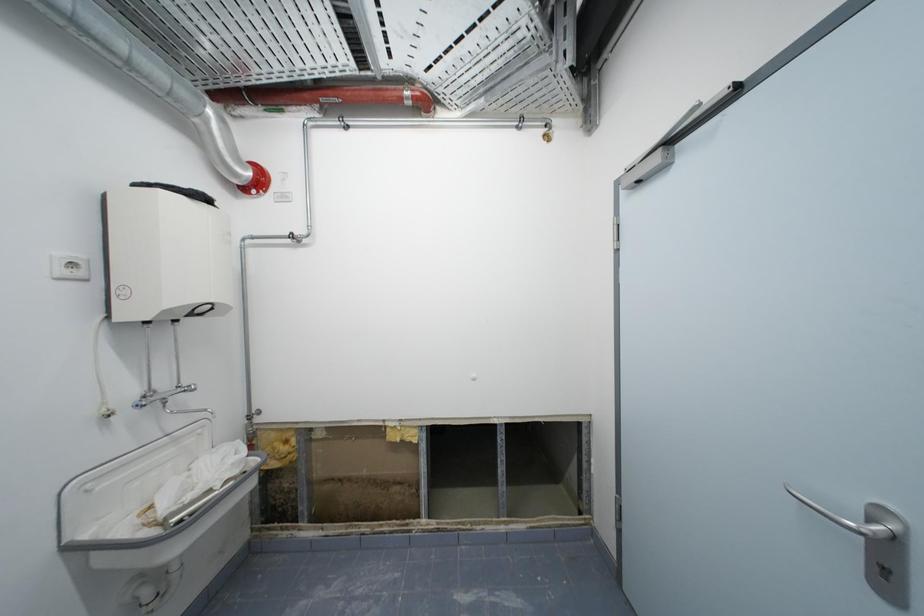
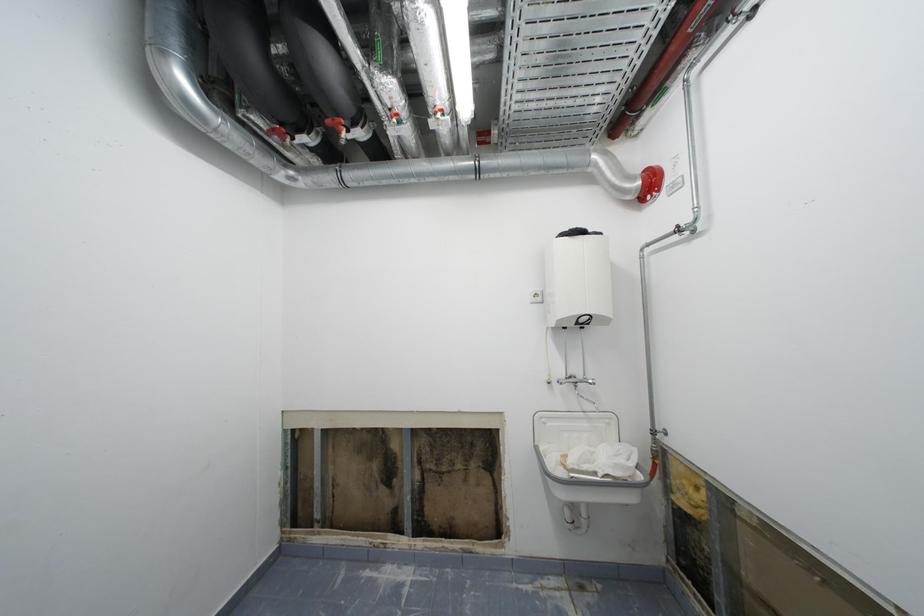
Question: The camera is either moving clockwise (left) or counter-clockwise (right) around the object. The first image is from the beginning of the video and the second image is from the end. Is the camera moving left or right when shooting the video?

Choices:
 (A) Left
 (B) Right

Answer: (B)